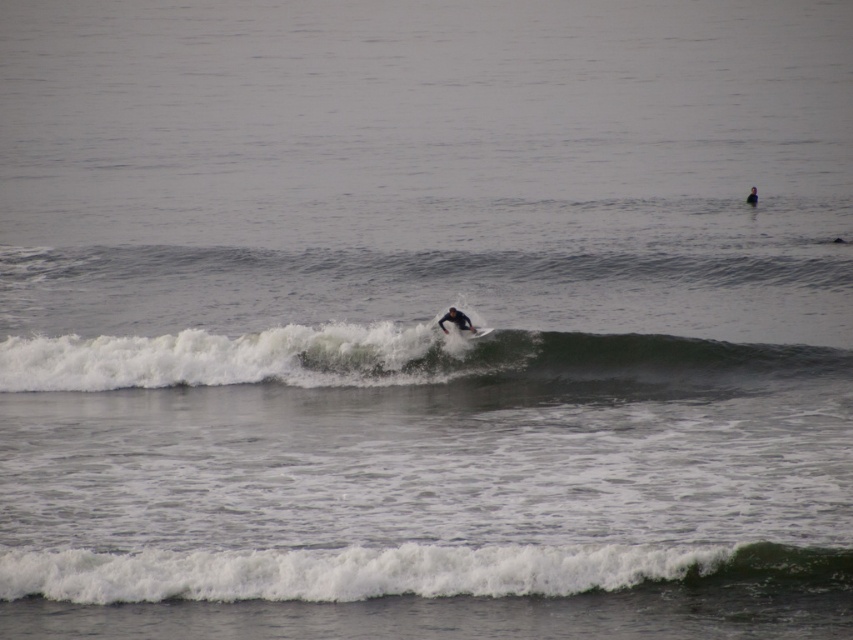
Question: Which point appears farthest from the camera in this image?

Choices:
 (A) (753, 202)
 (B) (628, 371)
 (C) (630, 570)
 (D) (461, 333)

Answer: (A)

Question: Is white foam surfboard at center further to the viewer compared to black matte wetsuit at center?

Choices:
 (A) yes
 (B) no

Answer: (B)

Question: Among these points, which one is farthest from the camera?

Choices:
 (A) (577, 362)
 (B) (747, 202)
 (C) (631, 566)

Answer: (B)

Question: Does white foam wave at center appear on the left side of white foam surfboard at center?

Choices:
 (A) yes
 (B) no

Answer: (A)

Question: Can you confirm if white foam wave at center is positioned to the right of white foamy wave at lower center?

Choices:
 (A) no
 (B) yes

Answer: (A)

Question: Among these points, which one is farthest from the camera?

Choices:
 (A) (746, 198)
 (B) (828, 348)

Answer: (A)